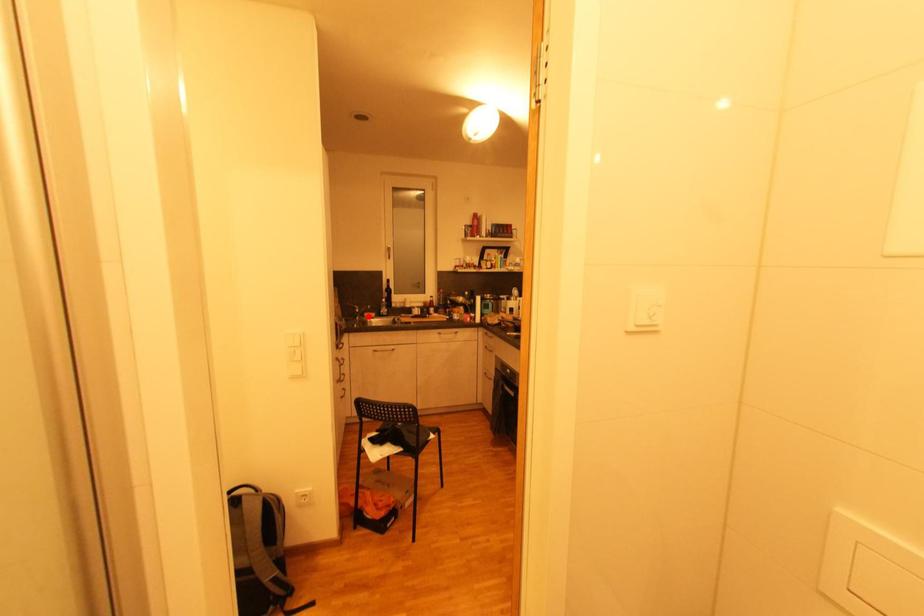
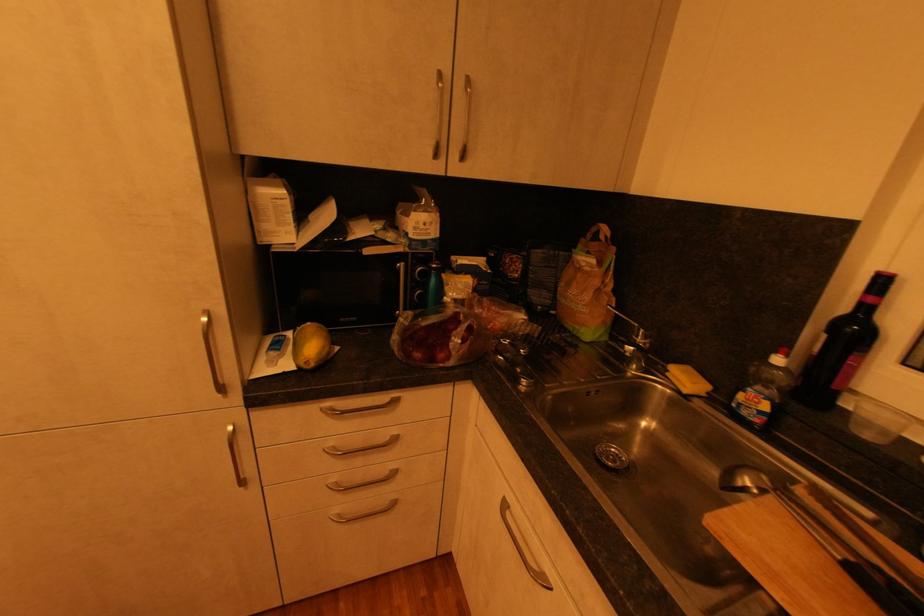
In the second image, find the point that corresponds to the highlighted location in the first image.

(672, 371)